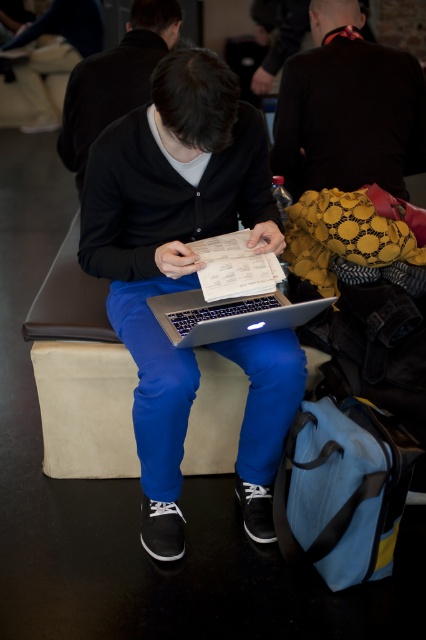
Question: Which point is farther to the camera?

Choices:
 (A) dark brown leather jacket at upper center
 (B) matte black laptop at center
 (C) matte black hoodie at center
 (D) sleek silver laptop at center

Answer: (C)

Question: Which of these objects is positioned farthest from the matte black laptop at center?

Choices:
 (A) dark brown leather jacket at upper center
 (B) matte black hoodie at center
 (C) sleek silver laptop at center

Answer: (B)

Question: Is matte black hoodie at center wider than sleek silver laptop at center?

Choices:
 (A) yes
 (B) no

Answer: (A)

Question: Is matte black hoodie at center to the right of sleek silver laptop at center from the viewer's perspective?

Choices:
 (A) yes
 (B) no

Answer: (B)

Question: Which is nearer to the matte black hoodie at center?

Choices:
 (A) sleek silver laptop at center
 (B) dark brown leather jacket at upper center

Answer: (B)

Question: Does matte black laptop at center have a lesser width compared to sleek silver laptop at center?

Choices:
 (A) no
 (B) yes

Answer: (A)